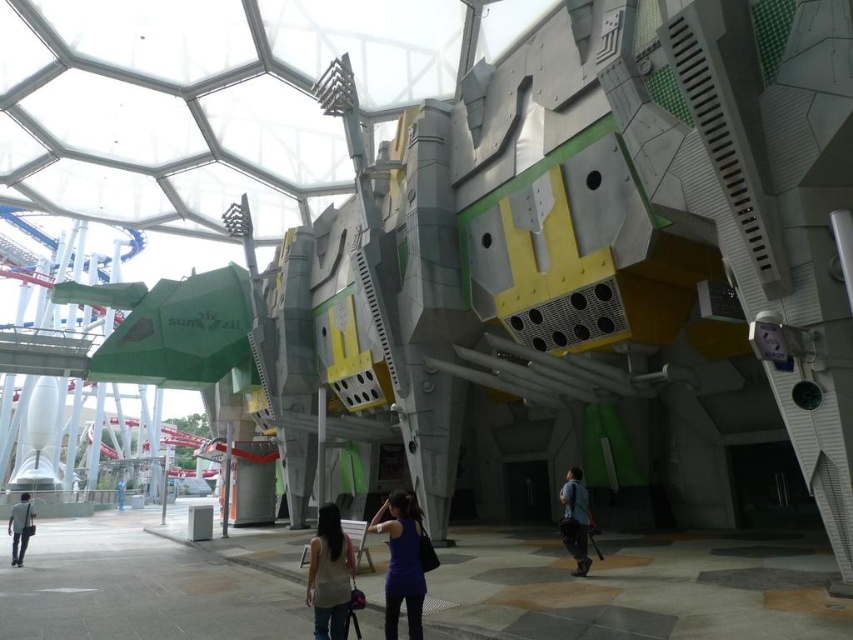
Question: Estimate the real-world distances between objects in this image. Which object is closer to the light blue shirt at lower left?

Choices:
 (A) blue fabric shirt at center
 (B) matte blue tank top at center

Answer: (B)

Question: Is blue fabric shirt at center bigger than dark blue fabric shirt at lower right?

Choices:
 (A) yes
 (B) no

Answer: (B)

Question: Considering the real-world distances, which object is farthest from the dark blue fabric shirt at lower right?

Choices:
 (A) blue fabric shirt at center
 (B) light beige fabric shirt at lower center
 (C) light blue shirt at lower left

Answer: (C)

Question: Is blue fabric shirt at center below light beige fabric shirt at lower center?

Choices:
 (A) yes
 (B) no

Answer: (B)

Question: Observing the image, what is the correct spatial positioning of matte blue tank top at center in reference to light blue shirt at lower left?

Choices:
 (A) right
 (B) left

Answer: (A)

Question: Which point is closer to the camera?

Choices:
 (A) light blue shirt at lower left
 (B) light beige fabric shirt at lower center
 (C) blue fabric shirt at center
 (D) matte blue tank top at center

Answer: (B)